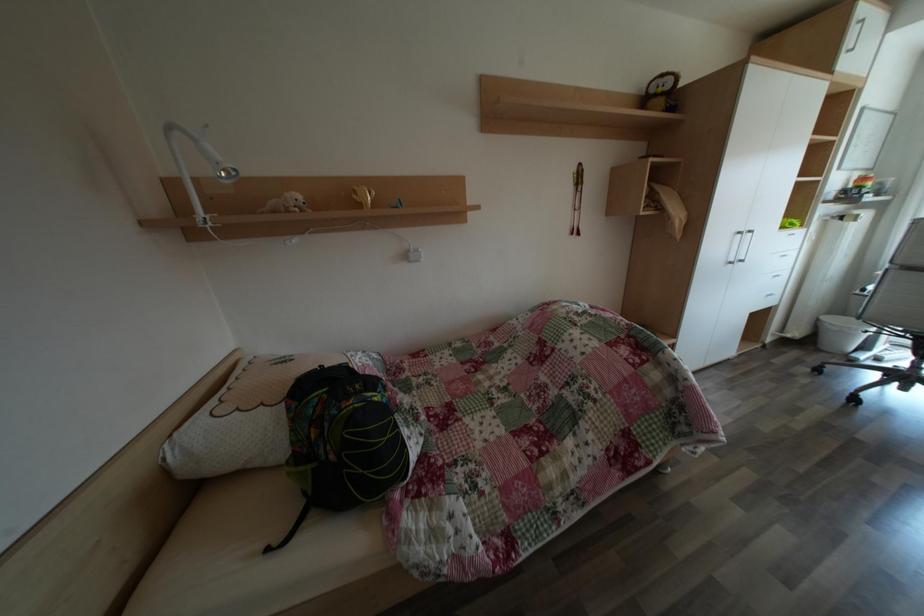
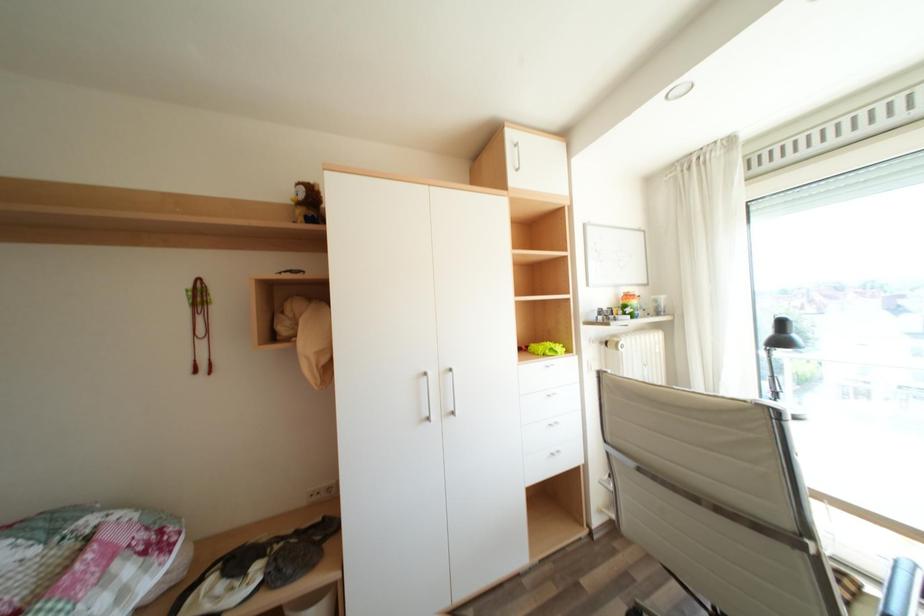
Question: In a continuous first-person perspective shot, in which direction is the camera moving?

Choices:
 (A) Left
 (B) Right
 (C) Forward
 (D) Backward

Answer: (B)